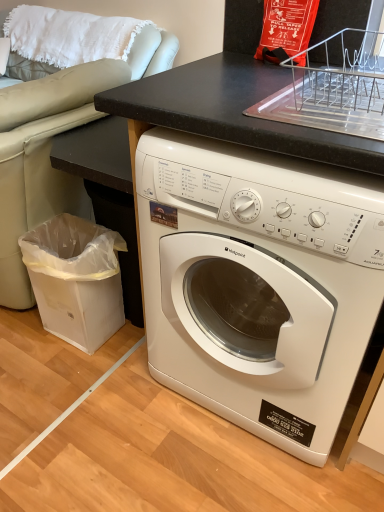
Question: Looking at their shapes, would you say transparent plastic trash can at lower left is wider or thinner than white glossy washing machine at center?

Choices:
 (A) wide
 (B) thin

Answer: (B)

Question: In terms of height, does transparent plastic trash can at lower left look taller or shorter compared to white glossy washing machine at center?

Choices:
 (A) short
 (B) tall

Answer: (A)

Question: Is transparent plastic trash can at lower left spatially inside white glossy washing machine at center, or outside of it?

Choices:
 (A) outside
 (B) inside

Answer: (A)

Question: In the image, is white glossy washing machine at center positioned in front of or behind transparent plastic trash can at lower left?

Choices:
 (A) front
 (B) behind

Answer: (A)

Question: Looking at their shapes, would you say white glossy washing machine at center is wider or thinner than transparent plastic trash can at lower left?

Choices:
 (A) thin
 (B) wide

Answer: (B)

Question: From the image's perspective, relative to transparent plastic trash can at lower left, is white glossy washing machine at center above or below?

Choices:
 (A) below
 (B) above

Answer: (B)

Question: Considering the relative positions of white glossy washing machine at center and transparent plastic trash can at lower left in the image provided, is white glossy washing machine at center to the left or to the right of transparent plastic trash can at lower left?

Choices:
 (A) right
 (B) left

Answer: (A)